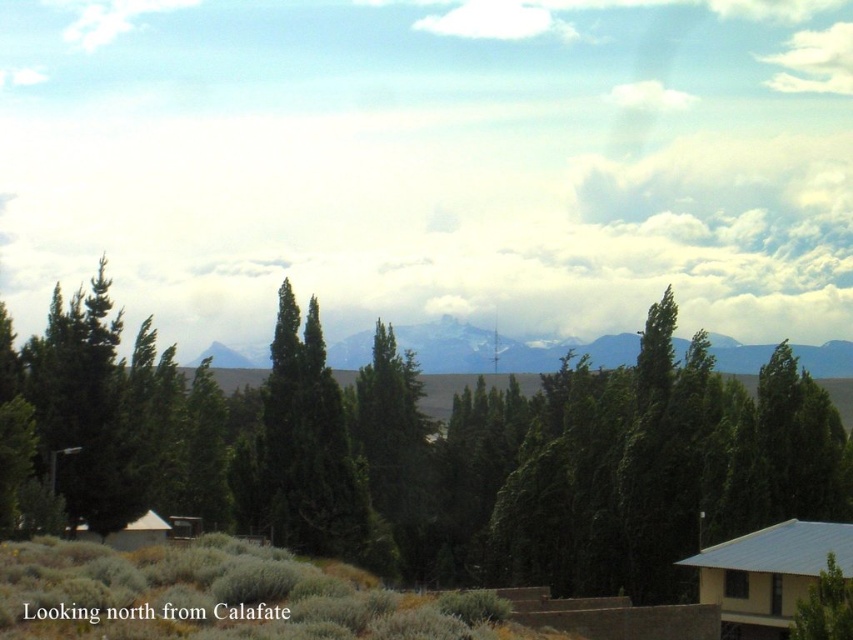
Does green leafy tree at center appear under green matte tree at left?

Indeed, green leafy tree at center is positioned under green matte tree at left.

Who is more forward, [511,476] or [71,440]?

Point [71,440]

You are a GUI agent. You are given a task and a screenshot of the screen. Output one action in this format:
    pyautogui.click(x=<x>, y=<y>)
    Task: Click on the green leafy tree at center
    
    Given the screenshot: What is the action you would take?
    pyautogui.click(x=430, y=452)

Is point (375, 564) positioned before point (529, 365)?

Yes, point (375, 564) is closer to viewer.

Which is behind, point (750, 444) or point (833, 376)?

Positioned behind is point (833, 376).

Find the location of a particular element. green leafy tree at center is located at coordinates tap(430, 452).

Does point (126, 376) lie in front of point (517, 353)?

Yes, it is in front of point (517, 353).

Is green matte tree at left in front of snowy granite mountain at center?

That is True.

The width and height of the screenshot is (853, 640). What are the coordinates of `green matte tree at left` in the screenshot? It's located at (119, 419).